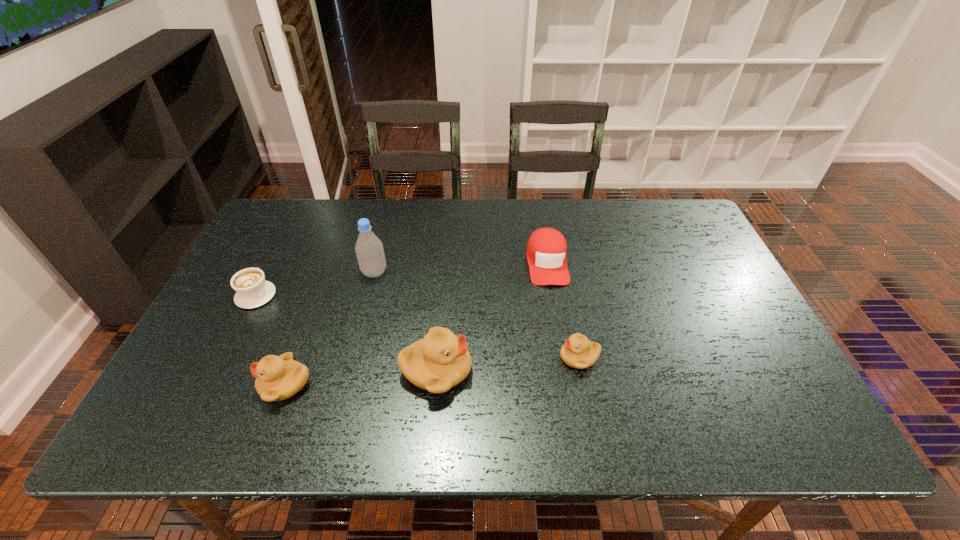
Where is `vacant region that satisfies the following two spatial constraints: 1. on the front-facing side of the baseball cap; 2. at the beak of the leftmost duckling`? This screenshot has width=960, height=540. vacant region that satisfies the following two spatial constraints: 1. on the front-facing side of the baseball cap; 2. at the beak of the leftmost duckling is located at coordinates (566, 384).

Where is `free location that satisfies the following two spatial constraints: 1. on the front-facing side of the baseball cap; 2. at the beak of the fifth object from right to left`? free location that satisfies the following two spatial constraints: 1. on the front-facing side of the baseball cap; 2. at the beak of the fifth object from right to left is located at coordinates (566, 384).